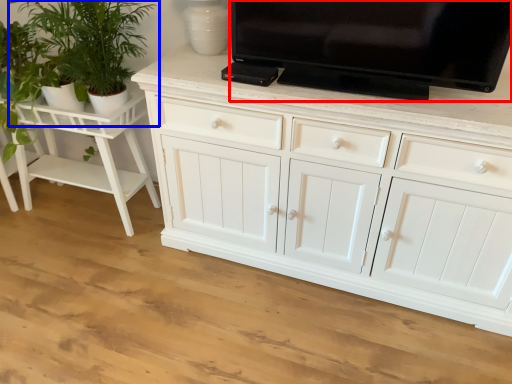
Question: Among these objects, which one is nearest to the camera, television (highlighted by a red box) or houseplant (highlighted by a blue box)?

Choices:
 (A) television
 (B) houseplant

Answer: (A)